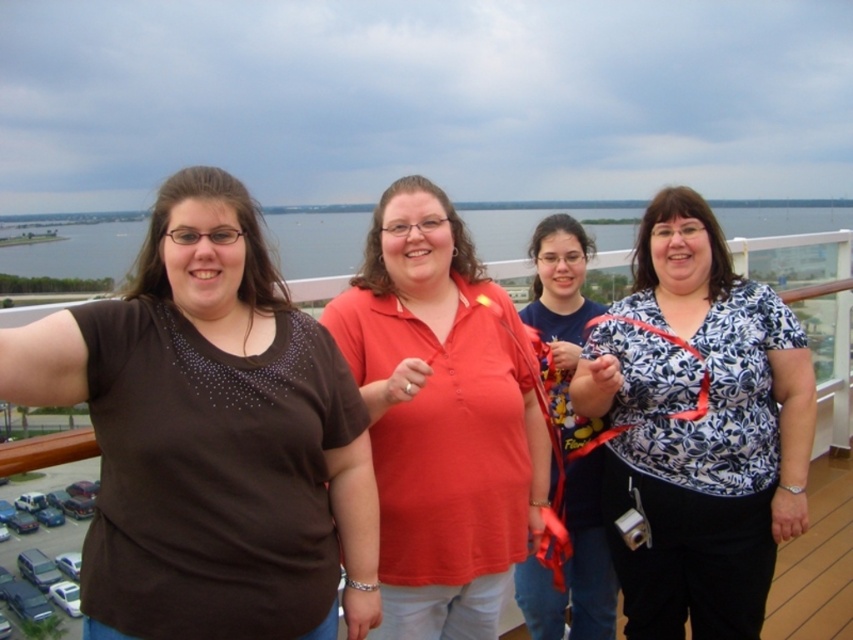
The height and width of the screenshot is (640, 853). I want to click on matte red polo shirt at center, so click(x=440, y=419).

The height and width of the screenshot is (640, 853). What do you see at coordinates (440, 419) in the screenshot?
I see `matte red polo shirt at center` at bounding box center [440, 419].

Where is `matte red polo shirt at center`? Image resolution: width=853 pixels, height=640 pixels. matte red polo shirt at center is located at coordinates (440, 419).

Does matte brown shirt at left have a greater height compared to white floral blouse at center?

Incorrect, matte brown shirt at left's height is not larger of white floral blouse at center's.

Is point (229, 300) positioned in front of point (706, 428)?

Yes, it is in front of point (706, 428).

Find the location of a particular element. matte brown shirt at left is located at coordinates (210, 436).

Locate an element on the screen. white floral blouse at center is located at coordinates (699, 428).

Does white floral blouse at center appear over matte red polo shirt at center?

Actually, white floral blouse at center is below matte red polo shirt at center.

Locate an element on the screen. white floral blouse at center is located at coordinates coord(699,428).

This screenshot has width=853, height=640. I want to click on white floral blouse at center, so click(x=699, y=428).